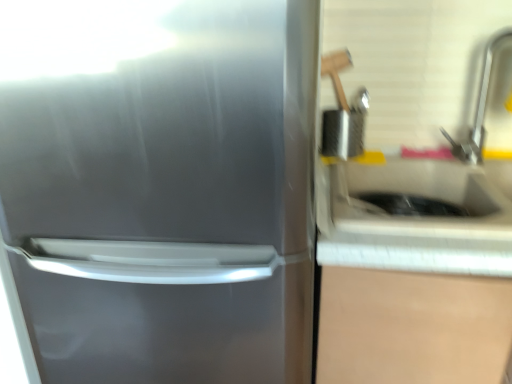
Question: Can you confirm if satin silver refrigerator at left is thinner than satin nickel faucet at upper right?

Choices:
 (A) no
 (B) yes

Answer: (A)

Question: Is satin silver refrigerator at left aimed at satin nickel faucet at upper right?

Choices:
 (A) yes
 (B) no

Answer: (B)

Question: Considering the relative sizes of satin silver refrigerator at left and satin nickel faucet at upper right in the image provided, is satin silver refrigerator at left smaller than satin nickel faucet at upper right?

Choices:
 (A) no
 (B) yes

Answer: (A)

Question: Is satin silver refrigerator at left to the left of satin nickel faucet at upper right from the viewer's perspective?

Choices:
 (A) yes
 (B) no

Answer: (A)

Question: Is satin silver refrigerator at left facing away from satin nickel faucet at upper right?

Choices:
 (A) no
 (B) yes

Answer: (A)

Question: Is white glossy sink at right inside the boundaries of satin silver refrigerator at left, or outside?

Choices:
 (A) outside
 (B) inside

Answer: (A)

Question: Is white glossy sink at right taller or shorter than satin silver refrigerator at left?

Choices:
 (A) short
 (B) tall

Answer: (A)

Question: In terms of width, does white glossy sink at right look wider or thinner when compared to satin silver refrigerator at left?

Choices:
 (A) thin
 (B) wide

Answer: (A)

Question: Based on their sizes in the image, would you say white glossy sink at right is bigger or smaller than satin silver refrigerator at left?

Choices:
 (A) big
 (B) small

Answer: (B)

Question: From the image's perspective, is satin nickel faucet at upper right above or below satin silver refrigerator at left?

Choices:
 (A) below
 (B) above

Answer: (B)

Question: Would you say satin nickel faucet at upper right is to the left or to the right of satin silver refrigerator at left in the picture?

Choices:
 (A) left
 (B) right

Answer: (B)

Question: Considering the positions of satin nickel faucet at upper right and satin silver refrigerator at left in the image, is satin nickel faucet at upper right bigger or smaller than satin silver refrigerator at left?

Choices:
 (A) big
 (B) small

Answer: (B)

Question: Which is correct: satin nickel faucet at upper right is inside satin silver refrigerator at left, or outside of it?

Choices:
 (A) inside
 (B) outside

Answer: (B)

Question: Choose the correct answer: Is satin nickel faucet at upper right inside white glossy sink at right or outside it?

Choices:
 (A) outside
 (B) inside

Answer: (A)

Question: Relative to white glossy sink at right, is satin nickel faucet at upper right in front or behind?

Choices:
 (A) front
 (B) behind

Answer: (B)